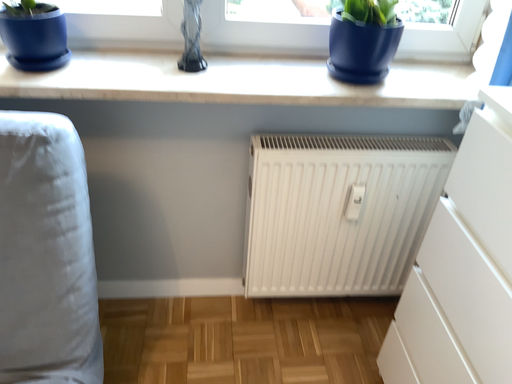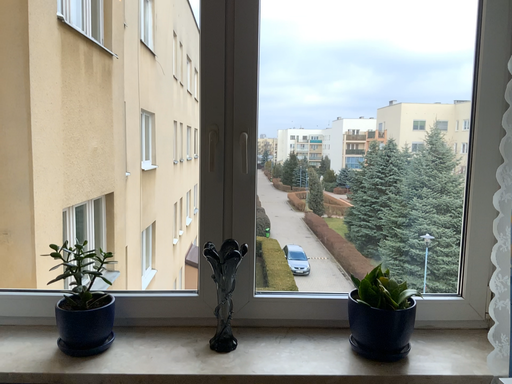
Question: Which way did the camera rotate in the video?

Choices:
 (A) rotated upward
 (B) rotated downward

Answer: (A)